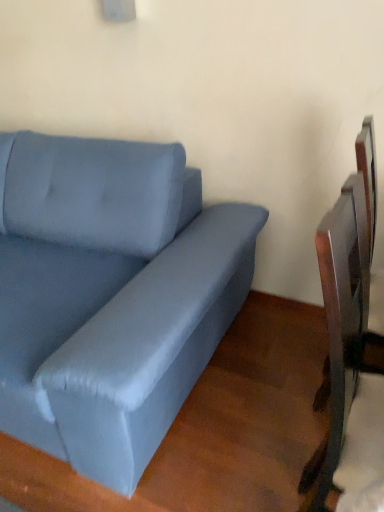
Locate an element on the screen. This screenshot has width=384, height=512. free spot to the left of metallic silver swivel chair at right is located at coordinates (271, 391).